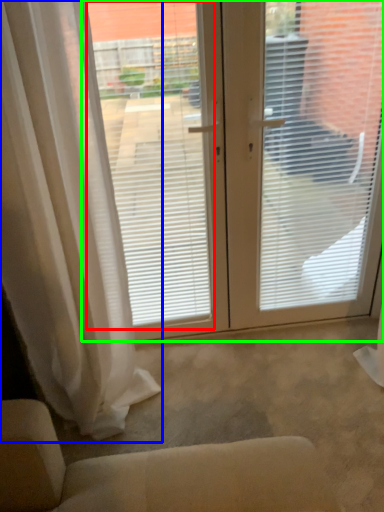
Question: Which object is positioned closest to window screen (highlighted by a red box)? Select from curtain (highlighted by a blue box) and window screen (highlighted by a green box).

Choices:
 (A) curtain
 (B) window screen

Answer: (B)